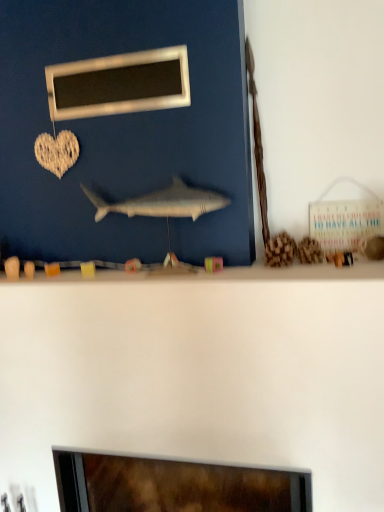
Where is `gray matte shark at center`? Image resolution: width=384 pixels, height=512 pixels. gray matte shark at center is located at coordinates (162, 202).

The width and height of the screenshot is (384, 512). What do you see at coordinates (162, 202) in the screenshot? I see `gray matte shark at center` at bounding box center [162, 202].

Identify the location of metallic rectangular frame at upper center. (119, 84).

What is the approximate height of metallic rectangular frame at upper center?

metallic rectangular frame at upper center is 7.12 inches tall.

The image size is (384, 512). Describe the element at coordinates (119, 84) in the screenshot. I see `metallic rectangular frame at upper center` at that location.

Find the location of a particular element. gray matte shark at center is located at coordinates coord(162,202).

Can you confirm if gray matte shark at center is positioned to the left of metallic rectangular frame at upper center?

In fact, gray matte shark at center is to the right of metallic rectangular frame at upper center.

Considering the positions of objects gray matte shark at center and metallic rectangular frame at upper center in the image provided, who is in front, gray matte shark at center or metallic rectangular frame at upper center?

gray matte shark at center is closer to the camera.

Is point (101, 213) less distant than point (109, 88)?

No.

Based on the photo, from the image's perspective, which object appears higher, gray matte shark at center or metallic rectangular frame at upper center?

metallic rectangular frame at upper center is shown above in the image.

From a real-world perspective, who is located lower, gray matte shark at center or metallic rectangular frame at upper center?

From a 3D spatial view, gray matte shark at center is below.

Which object is wider, gray matte shark at center or metallic rectangular frame at upper center?

With larger width is gray matte shark at center.

From the picture: Who is taller, gray matte shark at center or metallic rectangular frame at upper center?

Standing taller between the two is metallic rectangular frame at upper center.

Who is smaller, gray matte shark at center or metallic rectangular frame at upper center?

Smaller between the two is metallic rectangular frame at upper center.

Choose the correct answer: Is gray matte shark at center inside metallic rectangular frame at upper center or outside it?

The correct answer is: outside.

Is gray matte shark at center in contact with metallic rectangular frame at upper center?

No, gray matte shark at center is not with metallic rectangular frame at upper center.

Is gray matte shark at center oriented away from metallic rectangular frame at upper center?

No, gray matte shark at center's orientation is not away from metallic rectangular frame at upper center.

Can you tell me how much gray matte shark at center and metallic rectangular frame at upper center differ in facing direction?

1.63 degrees separate the facing orientations of gray matte shark at center and metallic rectangular frame at upper center.

Locate an element on the screen. This screenshot has width=384, height=512. picture frame located behind the gray matte shark at center is located at coordinates (119, 84).

Is metallic rectangular frame at upper center to the left of gray matte shark at center from the viewer's perspective?

Yes, metallic rectangular frame at upper center is to the left of gray matte shark at center.

Considering their positions, is metallic rectangular frame at upper center located in front of or behind gray matte shark at center?

Visually, metallic rectangular frame at upper center is located behind gray matte shark at center.

Does point (172, 97) come behind point (195, 212)?

Yes.

From the image's perspective, is metallic rectangular frame at upper center above or below gray matte shark at center?

metallic rectangular frame at upper center is situated higher than gray matte shark at center in the image.

From a real-world perspective, is metallic rectangular frame at upper center under gray matte shark at center?

No, from a real-world perspective, metallic rectangular frame at upper center is not below gray matte shark at center.

Considering the relative sizes of metallic rectangular frame at upper center and gray matte shark at center in the image provided, is metallic rectangular frame at upper center wider than gray matte shark at center?

Incorrect, the width of metallic rectangular frame at upper center does not surpass that of gray matte shark at center.

Between metallic rectangular frame at upper center and gray matte shark at center, which one has more height?

With more height is metallic rectangular frame at upper center.

Is metallic rectangular frame at upper center bigger or smaller than gray matte shark at center?

Considering their sizes, metallic rectangular frame at upper center takes up less space than gray matte shark at center.

Is metallic rectangular frame at upper center not inside gray matte shark at center?

metallic rectangular frame at upper center lies outside gray matte shark at center's area.

Would you say metallic rectangular frame at upper center is a long distance from gray matte shark at center?

No.

Does metallic rectangular frame at upper center turn towards gray matte shark at center?

No.

Can you tell me how much metallic rectangular frame at upper center and gray matte shark at center differ in facing direction?

1.63 degrees separate the facing orientations of metallic rectangular frame at upper center and gray matte shark at center.

How far apart are metallic rectangular frame at upper center and gray matte shark at center?

12.44 inches.

Where is `picture frame that is above the gray matte shark at center (from a real-world perspective)`? The image size is (384, 512). picture frame that is above the gray matte shark at center (from a real-world perspective) is located at coordinates tap(119, 84).

The width and height of the screenshot is (384, 512). I want to click on fish in front of the metallic rectangular frame at upper center, so click(x=162, y=202).

In order to click on fish on the right of metallic rectangular frame at upper center in this screenshot , I will do `click(162, 202)`.